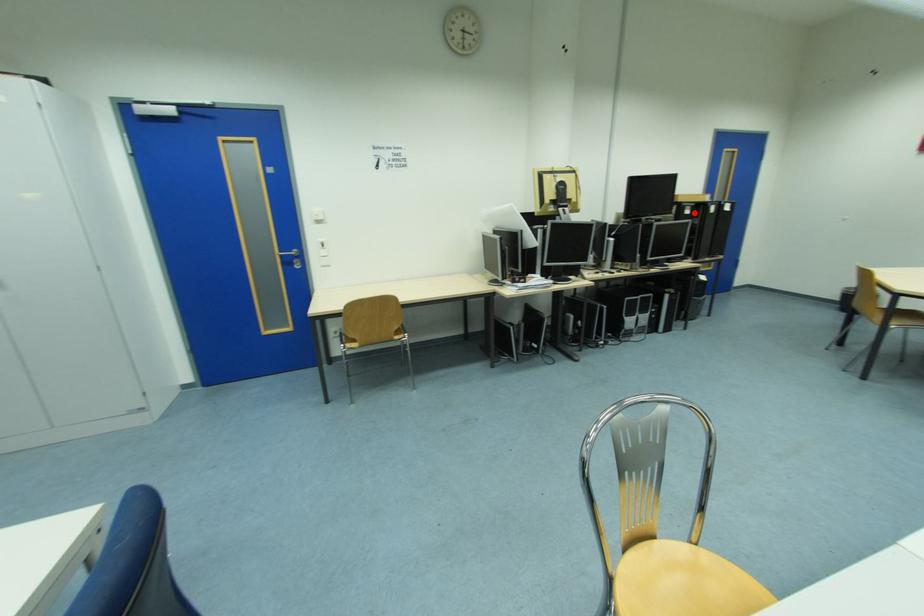
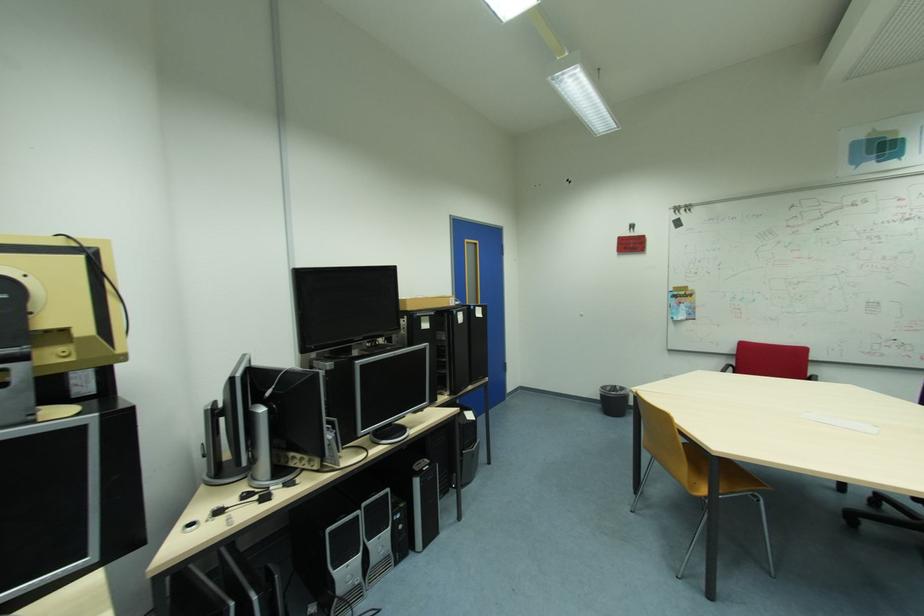
Question: I am providing you with two images of the same scene from different viewpoints. Image1 has a red point marked. In image2, the corresponding 3D location appears at what relative position? Reply with the corresponding letter.

Choices:
 (A) Closer
 (B) Farther

Answer: (B)